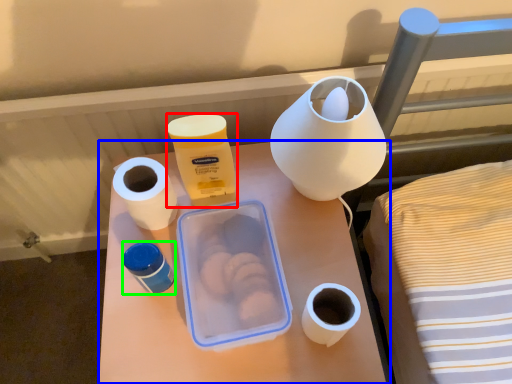
Question: Based on their relative distances, which object is farther from product (highlighted by a red box)? Choose from table (highlighted by a blue box) and pottery (highlighted by a green box).

Choices:
 (A) table
 (B) pottery

Answer: (A)